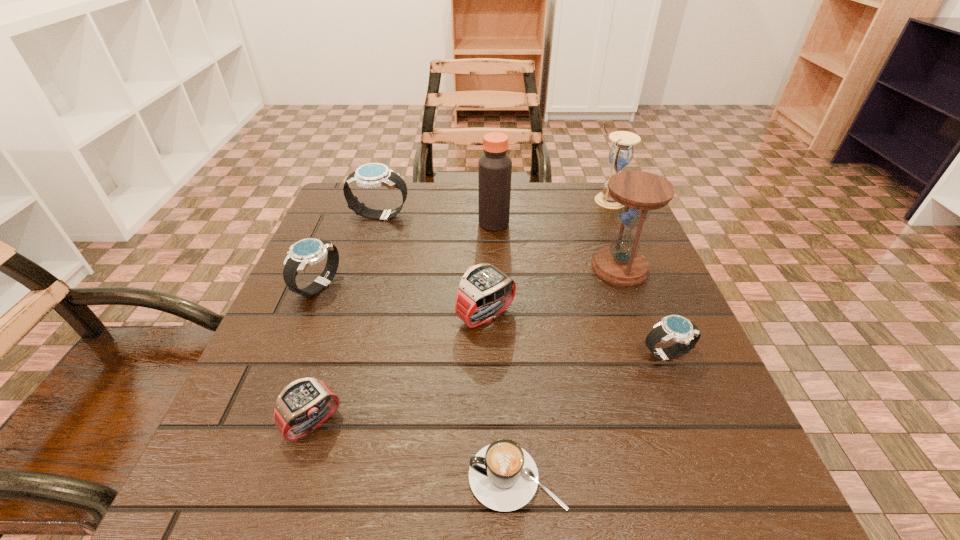
Where is `the smaller red watch`? This screenshot has height=540, width=960. the smaller red watch is located at coordinates (304, 405).

You are a GUI agent. You are given a task and a screenshot of the screen. Output one action in this format:
    pyautogui.click(x=<x>, y=<y>)
    Task: Click on the nearer red watch
    The image size is (960, 540).
    Given the screenshot: What is the action you would take?
    pyautogui.click(x=304, y=405)

This screenshot has width=960, height=540. I want to click on the shortest object, so click(503, 476).

Where is `cappuccino`? The height and width of the screenshot is (540, 960). cappuccino is located at coordinates (503, 476).

Where is `free location located on the front of the brown vinegar`? The width and height of the screenshot is (960, 540). free location located on the front of the brown vinegar is located at coordinates (496, 295).

The image size is (960, 540). I want to click on vacant space located 0.100m on the left of the white hourglass, so click(x=555, y=200).

The height and width of the screenshot is (540, 960). I want to click on free location located 0.200m on the front of the nearer hourglass, so click(x=656, y=364).

Where is `free space located 0.250m on the right of the biggest silver watch`? The height and width of the screenshot is (540, 960). free space located 0.250m on the right of the biggest silver watch is located at coordinates (509, 215).

Find the location of a particular element. The width and height of the screenshot is (960, 540). vacant point located on the right of the second biggest silver watch is located at coordinates (455, 286).

You are a GUI agent. You are given a task and a screenshot of the screen. Output one action in this format:
    pyautogui.click(x=<x>, y=<y>)
    Task: Click on the vacant space located on the front of the bigger red watch
    This screenshot has width=960, height=540.
    Given the screenshot: What is the action you would take?
    pyautogui.click(x=488, y=424)